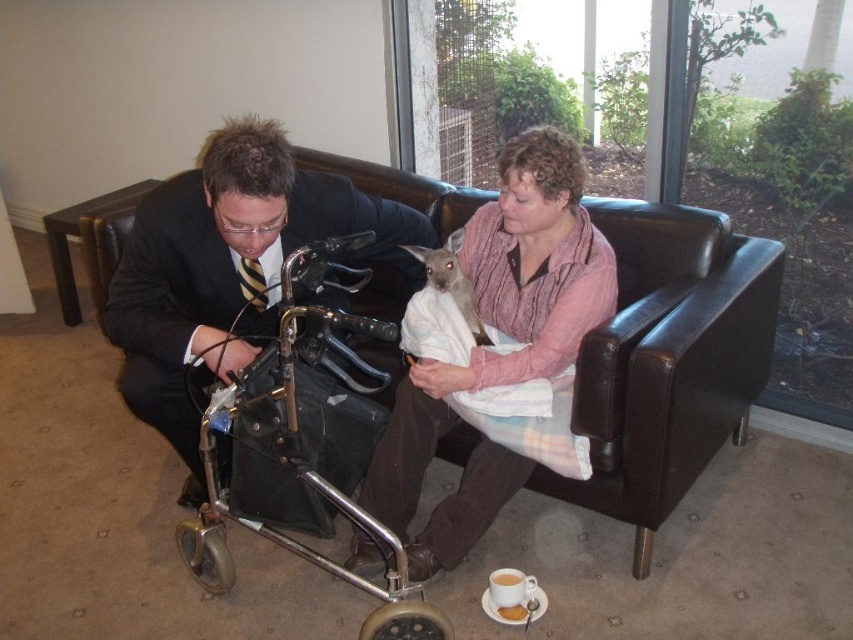
Question: Among these objects, which one is nearest to the camera?

Choices:
 (A) soft white kangaroo at center
 (B) black leather couch at center

Answer: (B)

Question: Is the position of dark blue suit at center more distant than that of soft white kangaroo at center?

Choices:
 (A) no
 (B) yes

Answer: (A)

Question: Among these points, which one is nearest to the camera?

Choices:
 (A) (498, 476)
 (B) (437, 275)
 (C) (711, 234)
 (D) (219, 202)

Answer: (D)

Question: Does dark blue suit at center have a larger size compared to pink cotton shirt at upper center?

Choices:
 (A) yes
 (B) no

Answer: (A)

Question: Is pink cotton shirt at upper center positioned behind soft white kangaroo at center?

Choices:
 (A) no
 (B) yes

Answer: (A)

Question: Which of the following is the closest to the observer?

Choices:
 (A) (453, 278)
 (B) (566, 333)

Answer: (B)